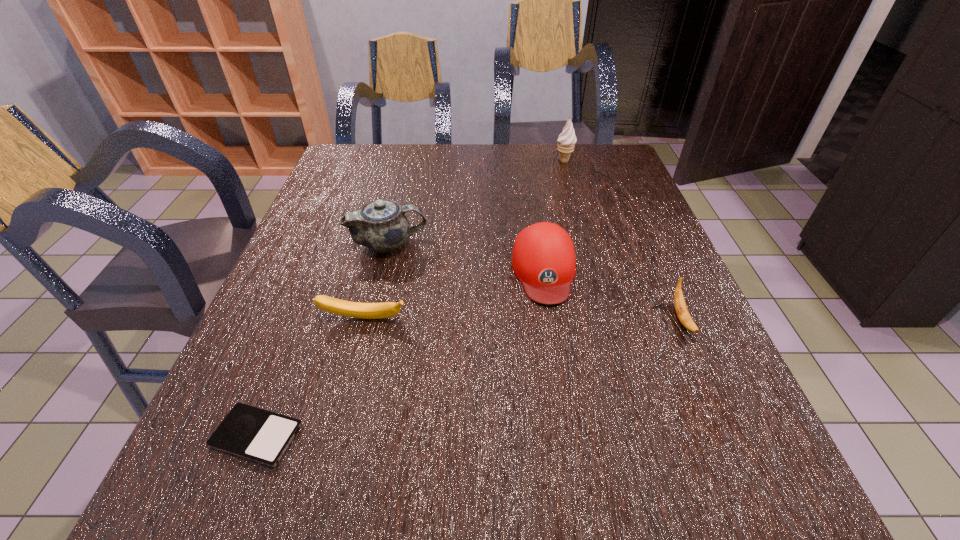
Identify the location of vacant region at the near right corner of the desktop. The width and height of the screenshot is (960, 540). (674, 477).

What are the coordinates of `vacant space in between the farthest object and the nearest object` in the screenshot? It's located at (410, 299).

You are a GUI agent. You are given a task and a screenshot of the screen. Output one action in this format:
    pyautogui.click(x=<x>, y=<y>)
    Task: Click on the empty space that is in between the fifth object from left to right and the third object from right to left
    Image resolution: width=960 pixels, height=540 pixels.
    Given the screenshot: What is the action you would take?
    pyautogui.click(x=554, y=216)

Locate an element on the screen. vacant space in between the icecream and the third tallest object is located at coordinates (554, 216).

The height and width of the screenshot is (540, 960). Find the location of `empty space that is in between the right banana and the farthest object`. empty space that is in between the right banana and the farthest object is located at coordinates (623, 240).

Where is `free space that is in between the third tallest object and the iPod`? This screenshot has height=540, width=960. free space that is in between the third tallest object and the iPod is located at coordinates (400, 353).

The width and height of the screenshot is (960, 540). In order to click on free space that is in between the chinaware and the nearest object in this screenshot , I will do 323,340.

The image size is (960, 540). I want to click on blank region between the right banana and the second object from right to left, so click(623, 240).

The image size is (960, 540). Find the location of `vacant space in between the rightmost object and the icecream`. vacant space in between the rightmost object and the icecream is located at coordinates (623, 240).

Locate an element on the screen. The width and height of the screenshot is (960, 540). vacant area that lies between the fifth object from left to right and the rightmost object is located at coordinates (623, 240).